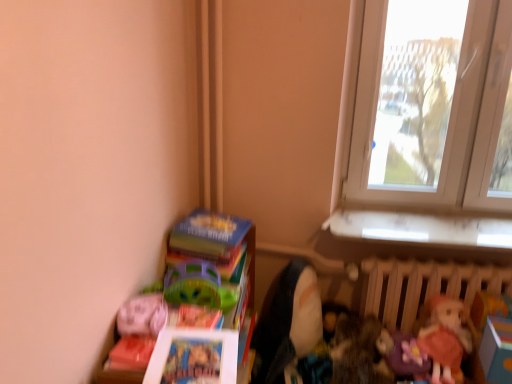
Question: Does matte pink plush at lower left turn towards white plastic window at upper right?

Choices:
 (A) no
 (B) yes

Answer: (A)

Question: Can you confirm if matte pink plush at lower left is taller than white plastic window at upper right?

Choices:
 (A) yes
 (B) no

Answer: (B)

Question: Does matte pink plush at lower left appear on the left side of white plastic window at upper right?

Choices:
 (A) yes
 (B) no

Answer: (A)

Question: Considering the relative sizes of matte pink plush at lower left and white plastic window at upper right in the image provided, is matte pink plush at lower left thinner than white plastic window at upper right?

Choices:
 (A) yes
 (B) no

Answer: (B)

Question: Can you confirm if matte pink plush at lower left is smaller than white plastic window at upper right?

Choices:
 (A) no
 (B) yes

Answer: (B)

Question: Is matte pink plush at lower left wider than white plastic window at upper right?

Choices:
 (A) yes
 (B) no

Answer: (A)

Question: Can you confirm if hardcover book at lower left is positioned to the left of matte pink doll at lower right, arranged as the second doll when viewed from the left?

Choices:
 (A) no
 (B) yes

Answer: (B)

Question: Considering the relative sizes of hardcover book at lower left and matte pink doll at lower right, which appears as the 1th doll when viewed from the right, in the image provided, is hardcover book at lower left smaller than matte pink doll at lower right, which appears as the 1th doll when viewed from the right,?

Choices:
 (A) no
 (B) yes

Answer: (A)

Question: Does hardcover book at lower left appear on the right side of matte pink doll at lower right, arranged as the second doll when viewed from the left?

Choices:
 (A) yes
 (B) no

Answer: (B)

Question: From a real-world perspective, is hardcover book at lower left located beneath matte pink doll at lower right, arranged as the second doll when viewed from the left?

Choices:
 (A) yes
 (B) no

Answer: (B)

Question: Does hardcover book at lower left have a larger size compared to matte pink doll at lower right, arranged as the second doll when viewed from the left?

Choices:
 (A) yes
 (B) no

Answer: (A)

Question: Is matte pink doll at lower right, arranged as the second doll when viewed from the left, inside hardcover book at lower left?

Choices:
 (A) no
 (B) yes

Answer: (A)

Question: From the image's perspective, is matte plastic books at lower left above matte pink plush at lower left?

Choices:
 (A) yes
 (B) no

Answer: (B)